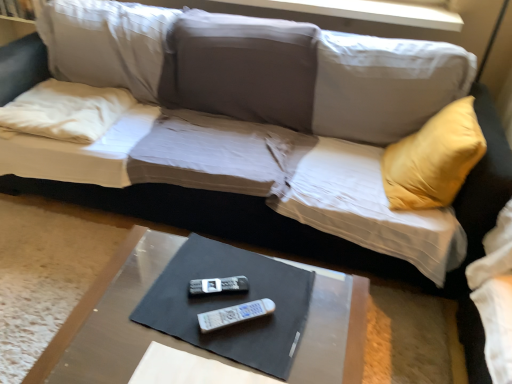
Where is `free region on the left part of white plastic remote at center, the 1th remote in the front-to-back sequence`? The height and width of the screenshot is (384, 512). free region on the left part of white plastic remote at center, the 1th remote in the front-to-back sequence is located at coordinates (175, 316).